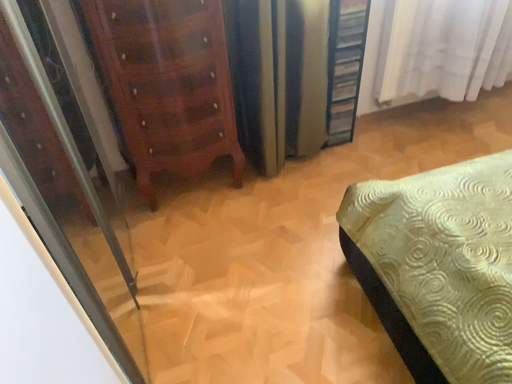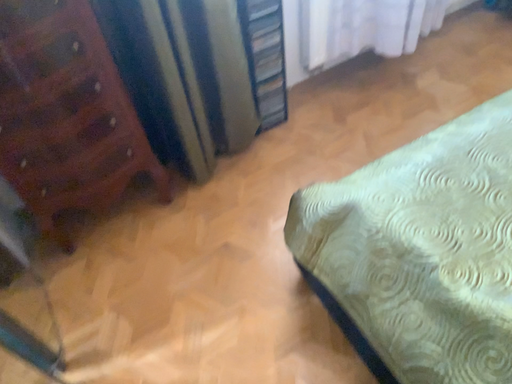
Question: How did the camera likely rotate when shooting the video?

Choices:
 (A) rotated right
 (B) rotated left

Answer: (A)